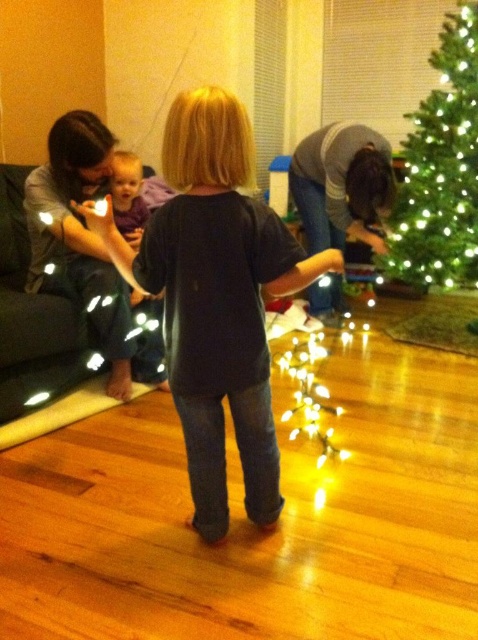
What object is located at the coordinates point (441,168)?

The point (441,168) indicates the green matte christmas tree at right.

Consider the image. In the festive living room scene, there is a dark blue shirt at center and a green matte Christmas tree at right. From the perspective of someone standing where the child is, which object is closer to the right side?

The green matte Christmas tree at right is closer to the right side because it is positioned to the right of the dark blue shirt at center.

You are a delivery person who needs to place a gift box between the green matte christmas tree at right and the matte purple shirt at upper left. The gift box is 2.3 feet long. Will it fit in the space between them?

The space between the green matte christmas tree at right and the matte purple shirt at upper left is 4.60 feet. Since the gift box is 2.3 feet long, it will fit comfortably within the available space.